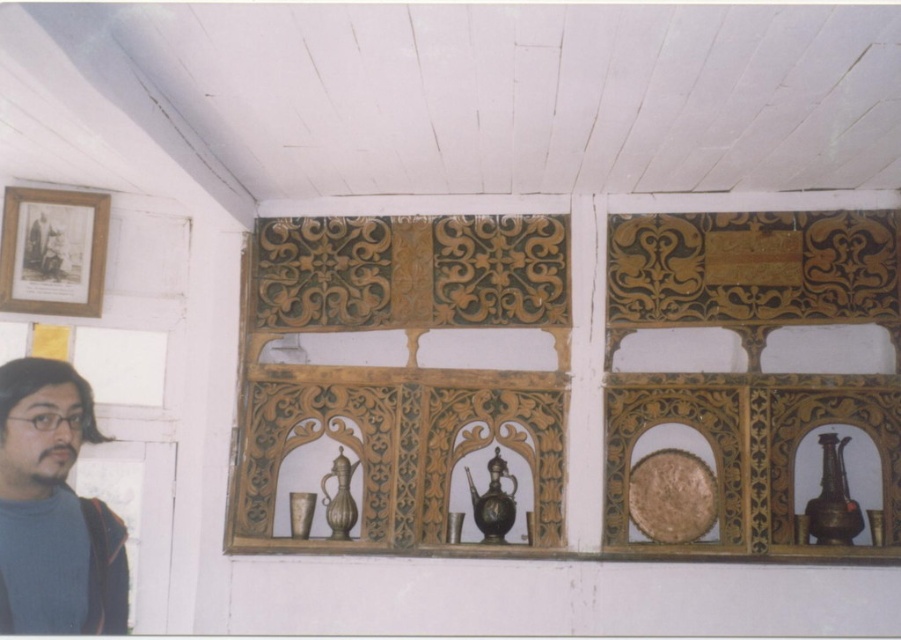
Is bronze metallic vase at right to the right of shiny brass vase at center from the viewer's perspective?

Yes, bronze metallic vase at right is to the right of shiny brass vase at center.

Does bronze metallic vase at right have a greater height compared to shiny brass vase at center?

Yes.

What do you see at coordinates (833, 497) in the screenshot?
I see `bronze metallic vase at right` at bounding box center [833, 497].

In order to click on bronze metallic vase at right in this screenshot , I will do `click(833, 497)`.

Which is more to the right, shiny brass vase at center or shiny bronze vase at center?

shiny brass vase at center is more to the right.

Who is shorter, shiny brass vase at center or shiny bronze vase at center?

shiny bronze vase at center is shorter.

What do you see at coordinates (493, 500) in the screenshot? This screenshot has height=640, width=901. I see `shiny brass vase at center` at bounding box center [493, 500].

Find the location of `shiny brass vase at center`. shiny brass vase at center is located at coordinates (493, 500).

Is bronze metallic vase at right smaller than shiny bronze vase at center?

No.

At what (x,y) coordinates should I click in order to perform the action: click on bronze metallic vase at right. Please return your answer as a coordinate pair (x, y). Looking at the image, I should click on tap(833, 497).